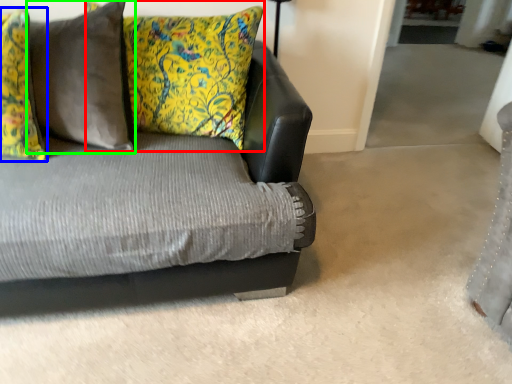
Question: Which object is positioned closest to pillow (highlighted by a red box)? Select from pillow (highlighted by a blue box) and pillow (highlighted by a green box).

Choices:
 (A) pillow
 (B) pillow

Answer: (B)